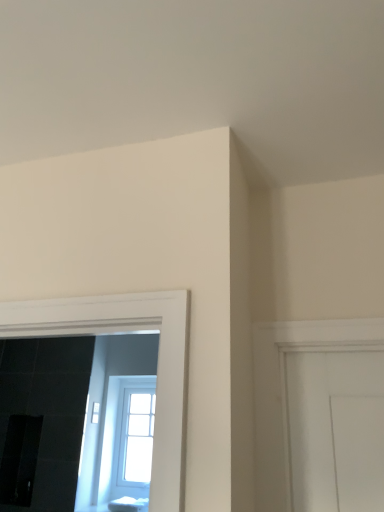
In order to click on white glossy sugar cube at lower center in this screenshot , I will do `click(128, 504)`.

Describe the element at coordinates (128, 504) in the screenshot. I see `white glossy sugar cube at lower center` at that location.

Find the location of `clear glass window at center`. clear glass window at center is located at coordinates [x=127, y=438].

This screenshot has height=512, width=384. What do you see at coordinates (127, 438) in the screenshot?
I see `clear glass window at center` at bounding box center [127, 438].

Find the location of a particular element. The width and height of the screenshot is (384, 512). white glossy sugar cube at lower center is located at coordinates (128, 504).

Between clear glass window at center and white glossy sugar cube at lower center, which one appears on the right side from the viewer's perspective?

white glossy sugar cube at lower center is more to the right.

Between clear glass window at center and white glossy sugar cube at lower center, which one is positioned in front?

white glossy sugar cube at lower center is closer to the camera.

Is point (144, 433) less distant than point (122, 503)?

No, (144, 433) is further to viewer.

From the image's perspective, does clear glass window at center appear lower than white glossy sugar cube at lower center?

No.

From a real-world perspective, which object stands above the other?

clear glass window at center, from a real-world perspective.

In terms of width, does clear glass window at center look wider or thinner when compared to white glossy sugar cube at lower center?

Clearly, clear glass window at center has less width compared to white glossy sugar cube at lower center.

Which of these two, clear glass window at center or white glossy sugar cube at lower center, stands taller?

clear glass window at center.

From the picture: Considering the sizes of objects clear glass window at center and white glossy sugar cube at lower center in the image provided, who is smaller, clear glass window at center or white glossy sugar cube at lower center?

white glossy sugar cube at lower center is smaller.

Is white glossy sugar cube at lower center completely or partially inside clear glass window at center?

No, white glossy sugar cube at lower center is located outside of clear glass window at center.

Is there a large distance between clear glass window at center and white glossy sugar cube at lower center?

They are positioned close to each other.

Could you tell me if clear glass window at center is turned towards white glossy sugar cube at lower center?

Yes, clear glass window at center is oriented towards white glossy sugar cube at lower center.

How many degrees apart are the facing directions of clear glass window at center and white glossy sugar cube at lower center?

The angle between the facing direction of clear glass window at center and the facing direction of white glossy sugar cube at lower center is 0.299 degrees.

Identify the location of furniture that is in front of the clear glass window at center. (128, 504).

Is white glossy sugar cube at lower center at the right side of clear glass window at center?

Yes.

Is the position of white glossy sugar cube at lower center more distant than that of clear glass window at center?

No, it is in front of clear glass window at center.

Between point (117, 507) and point (152, 385), which one is positioned behind?

The point (152, 385) is farther from the camera.

From the image's perspective, is white glossy sugar cube at lower center located above clear glass window at center?

No.

From a real-world perspective, is white glossy sugar cube at lower center positioned above or below clear glass window at center?

Clearly, from a real-world perspective, white glossy sugar cube at lower center is below clear glass window at center.

Looking at this image, considering the sizes of white glossy sugar cube at lower center and clear glass window at center in the image, is white glossy sugar cube at lower center wider or thinner than clear glass window at center?

white glossy sugar cube at lower center is wider than clear glass window at center.

Considering the relative sizes of white glossy sugar cube at lower center and clear glass window at center in the image provided, is white glossy sugar cube at lower center taller than clear glass window at center?

No, white glossy sugar cube at lower center is not taller than clear glass window at center.

Is white glossy sugar cube at lower center bigger than clear glass window at center?

No.

Does white glossy sugar cube at lower center contain clear glass window at center?

Actually, clear glass window at center is outside white glossy sugar cube at lower center.

Is white glossy sugar cube at lower center far away from clear glass window at center?

They are positioned close to each other.

Is white glossy sugar cube at lower center positioned with its back to clear glass window at center?

white glossy sugar cube at lower center is not turned away from clear glass window at center.

How much distance is there between white glossy sugar cube at lower center and clear glass window at center?

14.36 inches.

Locate an element on the screen. The height and width of the screenshot is (512, 384). furniture below the clear glass window at center (from a real-world perspective) is located at coordinates (128, 504).

This screenshot has width=384, height=512. I want to click on furniture below the clear glass window at center (from a real-world perspective), so click(128, 504).

In order to click on window that appears on the left of white glossy sugar cube at lower center in this screenshot , I will do `click(127, 438)`.